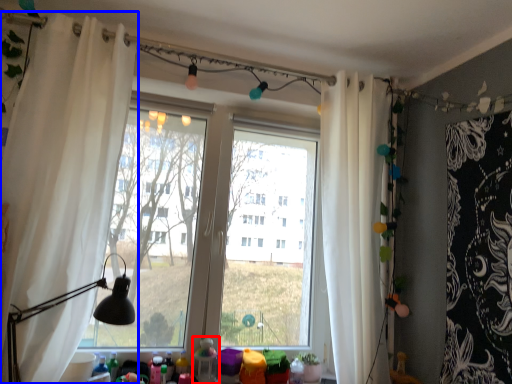
Question: Which object appears closest to the camera in this image, toy (highlighted by a red box) or curtain (highlighted by a blue box)?

Choices:
 (A) toy
 (B) curtain

Answer: (B)